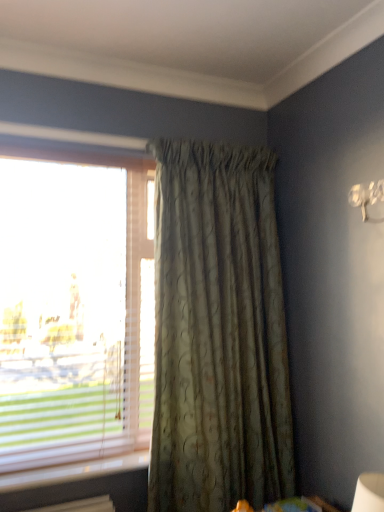
Question: Considering the relative sizes of translucent glass window at left and green textured curtain at center in the image provided, is translucent glass window at left bigger than green textured curtain at center?

Choices:
 (A) yes
 (B) no

Answer: (B)

Question: Does translucent glass window at left appear on the right side of green textured curtain at center?

Choices:
 (A) yes
 (B) no

Answer: (B)

Question: Is translucent glass window at left smaller than green textured curtain at center?

Choices:
 (A) yes
 (B) no

Answer: (A)

Question: Is translucent glass window at left positioned with its back to green textured curtain at center?

Choices:
 (A) no
 (B) yes

Answer: (A)

Question: Does translucent glass window at left have a greater height compared to green textured curtain at center?

Choices:
 (A) no
 (B) yes

Answer: (A)

Question: From the image's perspective, is translucent glass window at left over green textured curtain at center?

Choices:
 (A) no
 (B) yes

Answer: (B)

Question: From the image's perspective, is green textured curtain at center under translucent glass window at left?

Choices:
 (A) no
 (B) yes

Answer: (B)

Question: From a real-world perspective, is green textured curtain at center on translucent glass window at left?

Choices:
 (A) no
 (B) yes

Answer: (A)

Question: Is green textured curtain at center with translucent glass window at left?

Choices:
 (A) no
 (B) yes

Answer: (A)

Question: Can you confirm if green textured curtain at center is shorter than translucent glass window at left?

Choices:
 (A) no
 (B) yes

Answer: (A)

Question: Does green textured curtain at center have a lesser width compared to translucent glass window at left?

Choices:
 (A) yes
 (B) no

Answer: (B)

Question: Can you confirm if green textured curtain at center is wider than translucent glass window at left?

Choices:
 (A) no
 (B) yes

Answer: (B)

Question: From the image's perspective, is green textured curtain at center above or below translucent glass window at left?

Choices:
 (A) below
 (B) above

Answer: (A)